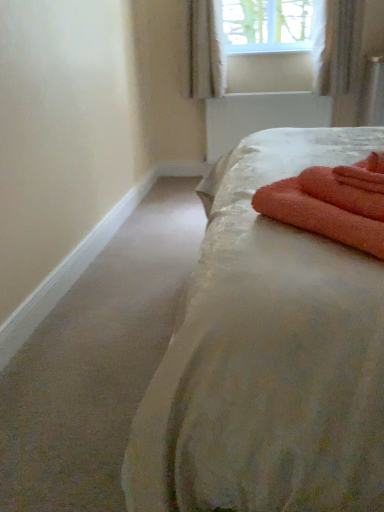
Question: Should I look upward or downward to see white textured curtain at upper right, which appears as the second curtain when viewed from the left?

Choices:
 (A) down
 (B) up

Answer: (B)

Question: Can you confirm if orange terry cloth bath towel at right is bigger than white sheer curtain at upper center, the first curtain positioned from the left?

Choices:
 (A) yes
 (B) no

Answer: (B)

Question: Is orange terry cloth bath towel at right oriented away from white sheer curtain at upper center, acting as the 2th curtain starting from the right?

Choices:
 (A) yes
 (B) no

Answer: (B)

Question: Is orange terry cloth bath towel at right completely or partially outside of white sheer curtain at upper center, acting as the 2th curtain starting from the right?

Choices:
 (A) yes
 (B) no

Answer: (A)

Question: Can you confirm if orange terry cloth bath towel at right is wider than white sheer curtain at upper center, the first curtain positioned from the left?

Choices:
 (A) no
 (B) yes

Answer: (B)

Question: Is orange terry cloth bath towel at right closer to camera compared to white sheer curtain at upper center, the first curtain positioned from the left?

Choices:
 (A) no
 (B) yes

Answer: (B)

Question: Can you confirm if orange terry cloth bath towel at right is positioned to the right of white sheer curtain at upper center, the first curtain positioned from the left?

Choices:
 (A) no
 (B) yes

Answer: (B)

Question: Is orange terry cloth bath towel at right facing away from silky white bed at center?

Choices:
 (A) yes
 (B) no

Answer: (A)

Question: Is orange terry cloth bath towel at right facing towards silky white bed at center?

Choices:
 (A) no
 (B) yes

Answer: (B)

Question: Can you confirm if orange terry cloth bath towel at right is wider than silky white bed at center?

Choices:
 (A) no
 (B) yes

Answer: (A)

Question: From a real-world perspective, is orange terry cloth bath towel at right located higher than silky white bed at center?

Choices:
 (A) no
 (B) yes

Answer: (B)

Question: From the image's perspective, is orange terry cloth bath towel at right above silky white bed at center?

Choices:
 (A) no
 (B) yes

Answer: (A)

Question: Is orange terry cloth bath towel at right not close to silky white bed at center?

Choices:
 (A) no
 (B) yes

Answer: (A)

Question: From a real-world perspective, is white textured curtain at upper right, which appears as the second curtain when viewed from the left, below white sheer curtain at upper center, the first curtain positioned from the left?

Choices:
 (A) no
 (B) yes

Answer: (B)